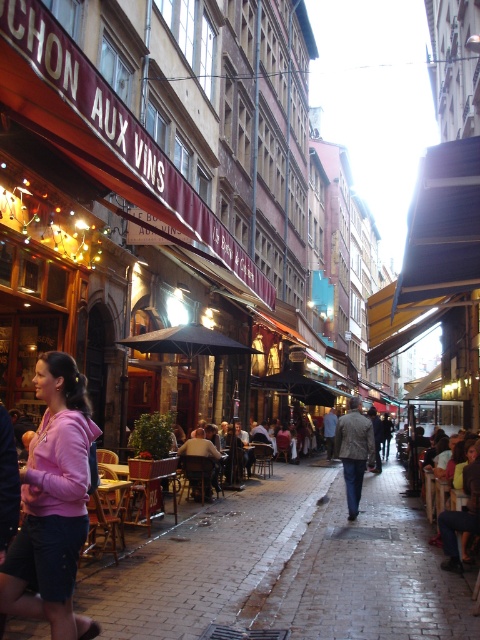
Where is `brick pavement at center`? This screenshot has width=480, height=640. brick pavement at center is located at coordinates (288, 566).

Does point (297, 524) come closer to viewer compared to point (72, 506)?

That is False.

Which is in front, point (149, 624) or point (48, 422)?

Point (48, 422) is in front.

Locate an element on the screen. The height and width of the screenshot is (640, 480). brick pavement at center is located at coordinates (288, 566).